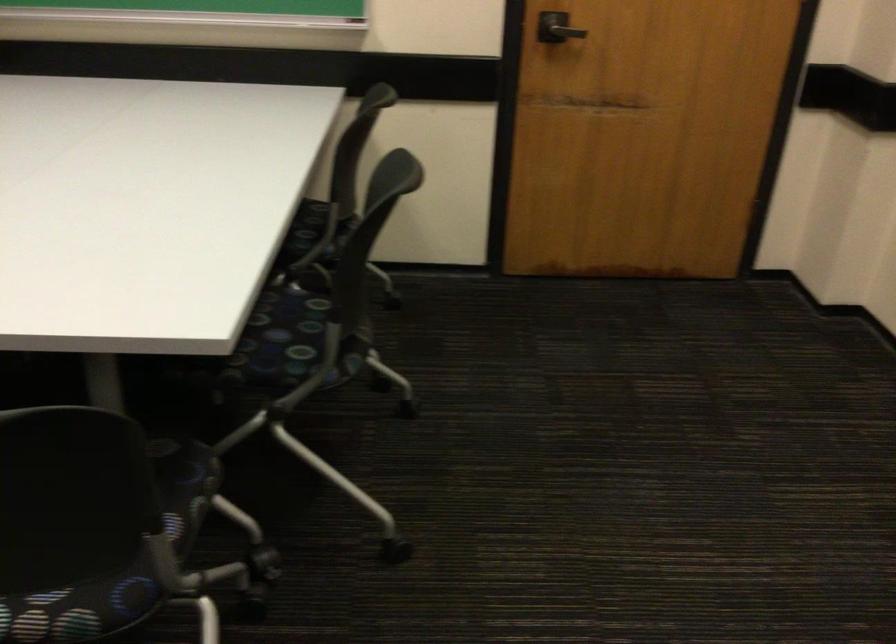
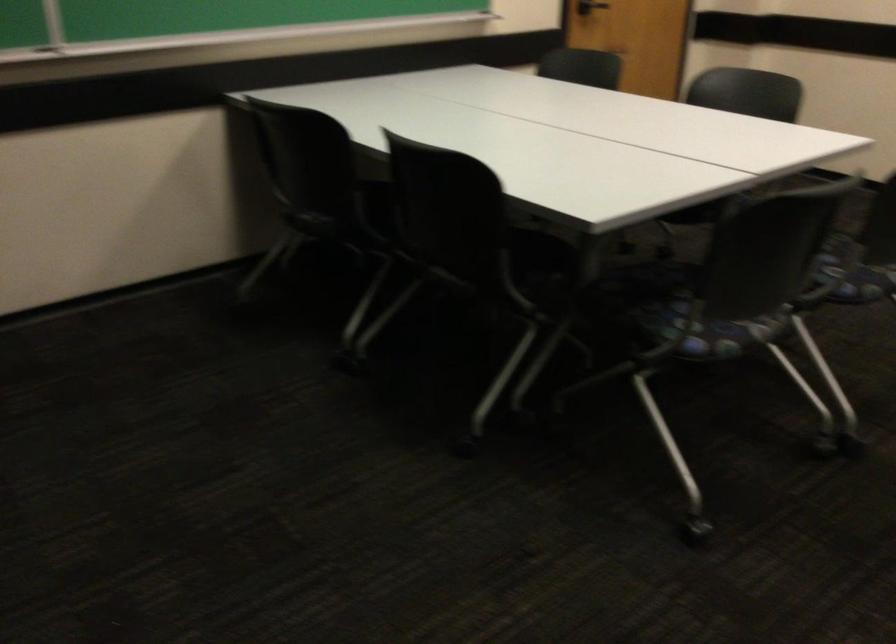
In the second image, find the point that corresponds to pixel 150 360 in the first image.

(703, 214)